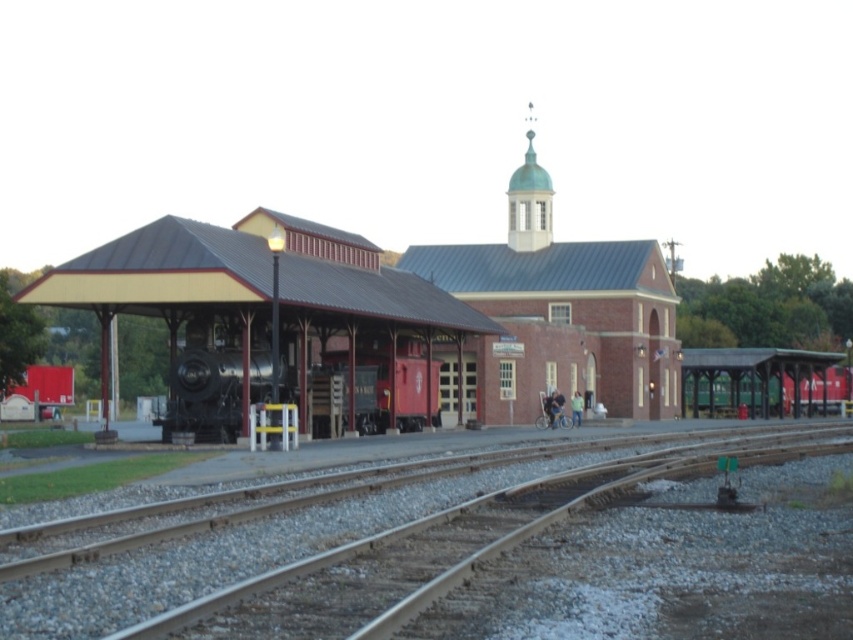
You are standing at the entrance of the train station and want to locate the smooth steel tracks at center. Based on the coordinates provided, in which direction should you look relative to your position?

The smooth steel tracks at center are located at coordinates point (x=349, y=556). Since the x coordinate is 0.869, which is closer to the right edge of the image, and the y coordinate is 0.410, which is closer to the bottom, you should look towards the lower right direction from your current position at the entrance.

You are a maintenance worker checking the tracks. You need to know if the smooth steel tracks at center are lower than the polished steel train at center. Can you confirm?

The smooth steel tracks at center has a lesser height compared to polished steel train at center, so yes, the tracks are lower than the train.